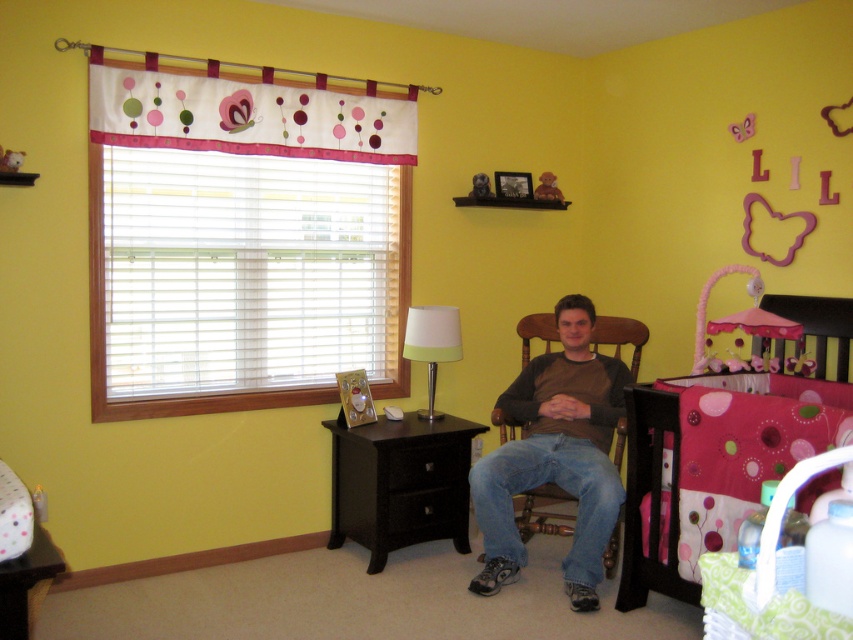
Question: Can you confirm if black wood dresser at lower center is bigger than pink fabric teddy bear at upper center?

Choices:
 (A) yes
 (B) no

Answer: (A)

Question: Which object is positioned farthest from the pink fabric crib at right?

Choices:
 (A) white fabric curtain at upper left
 (B) white matte lamp at center
 (C) pink fabric teddy bear at upper center

Answer: (A)

Question: Estimate the real-world distances between objects in this image. Which object is closer to the pink fabric teddy bear at upper center?

Choices:
 (A) pink fabric crib at right
 (B) white matte lamp at center
 (C) white fabric curtain at upper left
 (D) black wood dresser at lower center

Answer: (B)

Question: Which object is closer to the camera taking this photo?

Choices:
 (A) black wood dresser at lower center
 (B) white matte lamp at center

Answer: (A)

Question: Can you confirm if pink fabric crib at right is thinner than pink fabric teddy bear at upper center?

Choices:
 (A) yes
 (B) no

Answer: (B)

Question: Is brownmaterial sweater at center thinner than pink fabric crib at right?

Choices:
 (A) yes
 (B) no

Answer: (A)